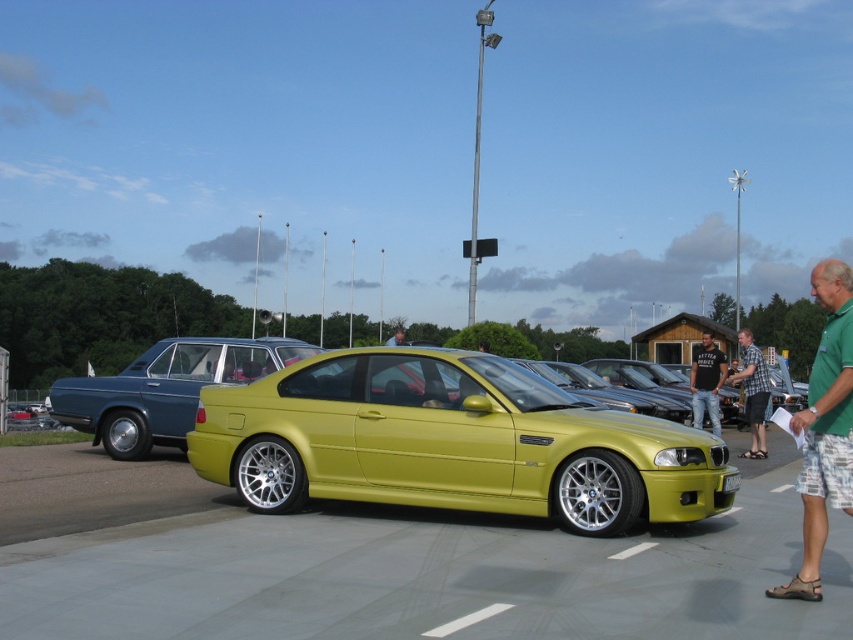
You are standing at the center of the image looking towards the bright yellow BMW sports car. Where is the green fabric shirt at right located in relation to your current position?

The green fabric shirt at right is located at point 0.669 on the x axis and 0.967 on the y axis relative to the image frame.

You are a photographer at the car show and want to capture both the metallic blue sedan at left and the yellow matte license plate at center in a single frame. Since you need to focus on the license plate, which object should you adjust your camera settings for first?

The metallic blue sedan at left is larger in size than yellow matte license plate at center, so you should adjust your camera settings for the yellow matte license plate at center first to ensure it is in focus and properly exposed.

Consider the image. You are at the car show and see two people wearing the green fabric shirt at right and the plaid shirt at center. Which person is standing closer to the bright yellow BMW sports car?

The green fabric shirt at right is to the left of the plaid shirt at center, so the green fabric shirt at right is closer to the bright yellow BMW sports car.